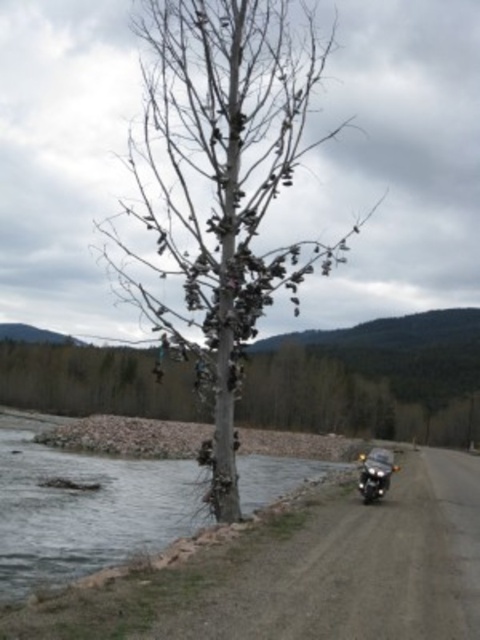
Question: Which point is closer to the camera?

Choices:
 (A) coord(368,454)
 (B) coord(135,285)

Answer: (B)

Question: Which point appears farthest from the camera in this image?

Choices:
 (A) (15, 624)
 (B) (382, 464)
 (C) (252, 154)

Answer: (B)

Question: Is shiny metallic shoes at center bigger than shiny black motorcycle at right?

Choices:
 (A) no
 (B) yes

Answer: (B)

Question: Which point appears closest to the camera in this image?

Choices:
 (A) (204, 628)
 (B) (288, 163)
 (C) (381, 461)

Answer: (A)

Question: Is shiny metallic shoes at center to the right of shiny black motorcycle at right from the viewer's perspective?

Choices:
 (A) yes
 (B) no

Answer: (B)

Question: Is clear water at lower left further to camera compared to shiny black motorcycle at right?

Choices:
 (A) yes
 (B) no

Answer: (B)